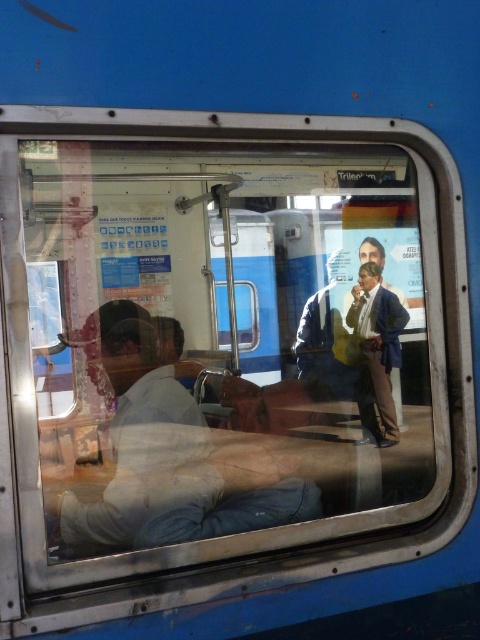
What do you see at coordinates (139, 436) in the screenshot? This screenshot has width=480, height=640. I see `light beige shirt at lower left` at bounding box center [139, 436].

Between point (172, 518) and point (367, 403), which one is positioned in front?

Point (172, 518) is more forward.

Find the location of a particular element. light beige shirt at lower left is located at coordinates (139, 436).